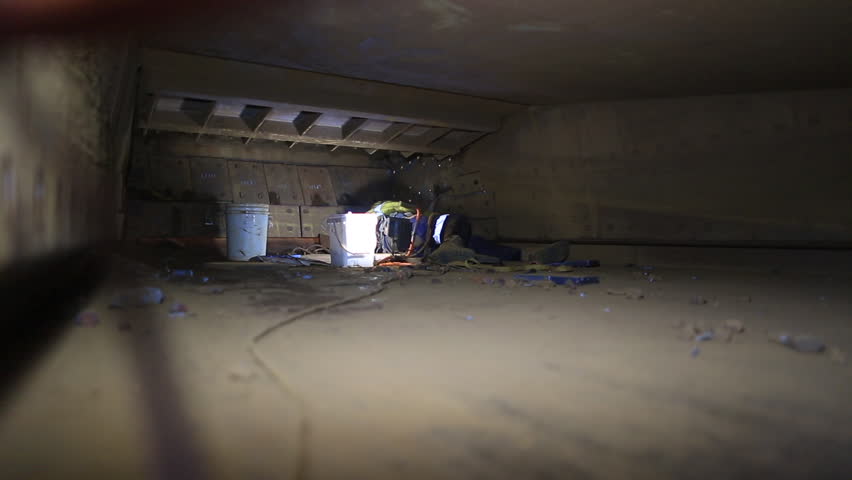
You are a GUI agent. You are given a task and a screenshot of the screen. Output one action in this format:
    pyautogui.click(x=<x>, y=<y>)
    Task: Click on the shadowy corner
    Image resolution: width=852 pixels, height=480 pixels.
    Given the screenshot: What is the action you would take?
    pyautogui.click(x=20, y=441), pyautogui.click(x=18, y=34), pyautogui.click(x=807, y=24), pyautogui.click(x=826, y=473)